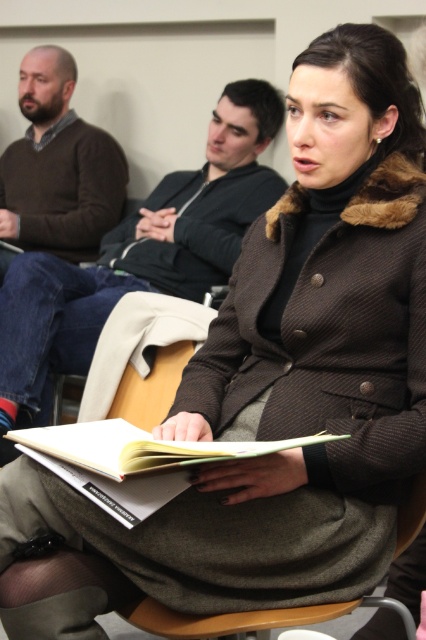
You are standing at the point with coordinates point (60, 108) and want to move to the point with coordinates point (155, 230). Is the point you want to reach located in front of or behind your current position?

The point (155, 230) is in front of point (60, 108), so the point you want to reach is located in front of your current position.

Based on the photo, please look at the coordinates point (138, 257). What object is located at this point?

The point (138, 257) corresponds to the brown sweater at center.

You are standing in the room and want to hand a document to the person wearing the brown sweater at center. Based on their position, where should you walk to find them?

The brown sweater at center is located at point 0.402 on the x axis and 0.324 on the y axis, so you should walk to that coordinate to find them.